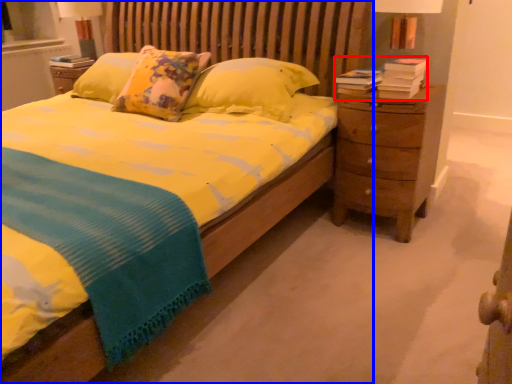
Question: Which point is further to the camera, book (highlighted by a red box) or bed (highlighted by a blue box)?

Choices:
 (A) book
 (B) bed

Answer: (A)